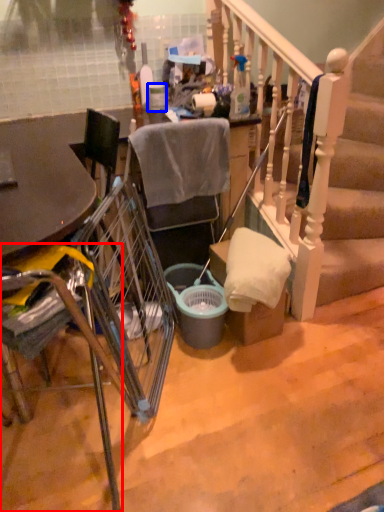
Question: Which point is further to the camera, chair (highlighted by a red box) or trash bin/can (highlighted by a blue box)?

Choices:
 (A) chair
 (B) trash bin/can

Answer: (B)